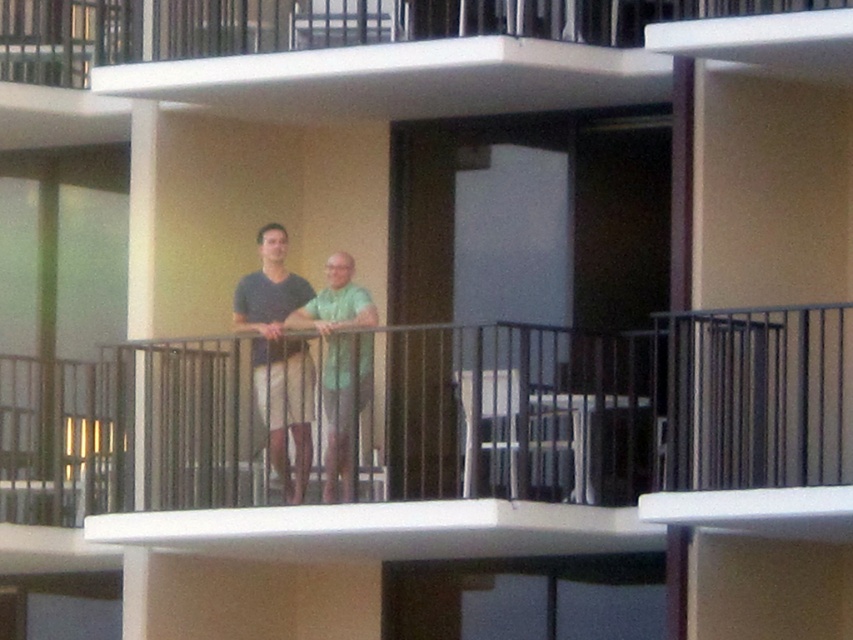
Question: Which of the following is the farthest from the observer?

Choices:
 (A) (283, 456)
 (B) (148, 1)

Answer: (B)

Question: Which point is farther to the camera?

Choices:
 (A) (4, 45)
 (B) (303, 301)

Answer: (A)

Question: Where is white concrete balcony at upper center located in relation to matte green shirt at center in the image?

Choices:
 (A) left
 (B) right

Answer: (B)

Question: Which object appears closest to the camera in this image?

Choices:
 (A) white concrete balcony at upper center
 (B) matte green shirt at center

Answer: (A)

Question: Does white concrete balcony at upper center have a larger size compared to matte green shirt at center?

Choices:
 (A) yes
 (B) no

Answer: (A)

Question: Does white concrete balcony at upper center lie in front of matte green shirt at center?

Choices:
 (A) yes
 (B) no

Answer: (A)